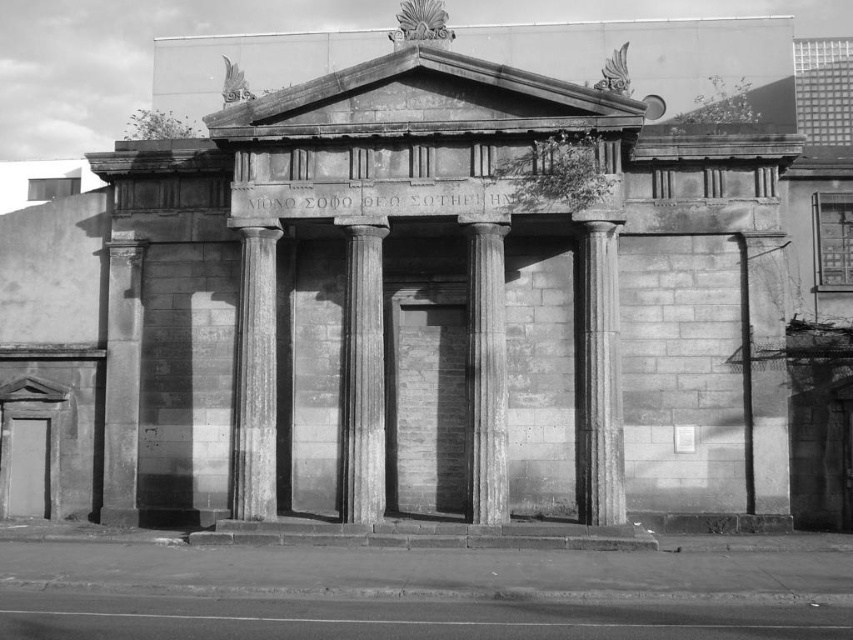
What are the coordinates of `granite column at center` in the screenshot? It's located at (598, 378).

Can you confirm if granite column at center is positioned to the right of gray stone column at center?

Correct, you'll find granite column at center to the right of gray stone column at center.

Is point (611, 369) positioned after point (381, 515)?

That is False.

At what (x,y) coordinates should I click in order to perform the action: click on granite column at center. Please return your answer as a coordinate pair (x, y). Looking at the image, I should click on (598, 378).

Between gray stone column at center and gray stone column at left, which one is positioned lower?

Positioned lower is gray stone column at left.

Can you confirm if gray stone column at center is positioned below gray stone column at left?

Actually, gray stone column at center is above gray stone column at left.

Identify the location of gray stone column at center. The image size is (853, 640). (363, 376).

Is point (264, 474) positioned before point (477, 408)?

No, (264, 474) is further to viewer.

Describe the element at coordinates (254, 376) in the screenshot. The height and width of the screenshot is (640, 853). I see `gray stone column at left` at that location.

This screenshot has height=640, width=853. Identify the location of gray stone column at left. (254, 376).

This screenshot has width=853, height=640. In order to click on gray stone column at left in this screenshot , I will do `click(254, 376)`.